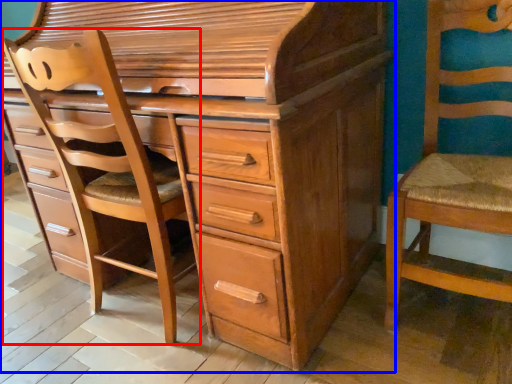
Question: Which of the following is the closest to the observer, armchair (highlighted by a red box) or chest of drawers (highlighted by a blue box)?

Choices:
 (A) armchair
 (B) chest of drawers

Answer: (B)